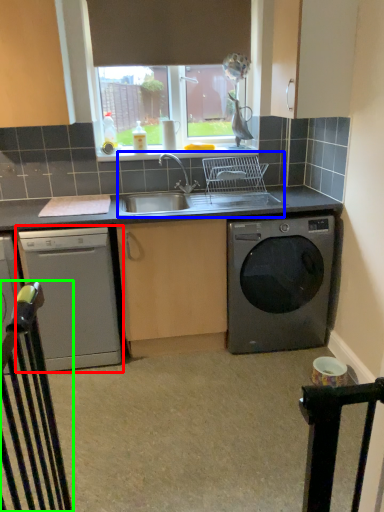
Question: Based on their relative distances, which object is nearer to dishwasher (highlighted by a red box)? Choose from sink (highlighted by a blue box) and rail (highlighted by a green box).

Choices:
 (A) sink
 (B) rail

Answer: (A)